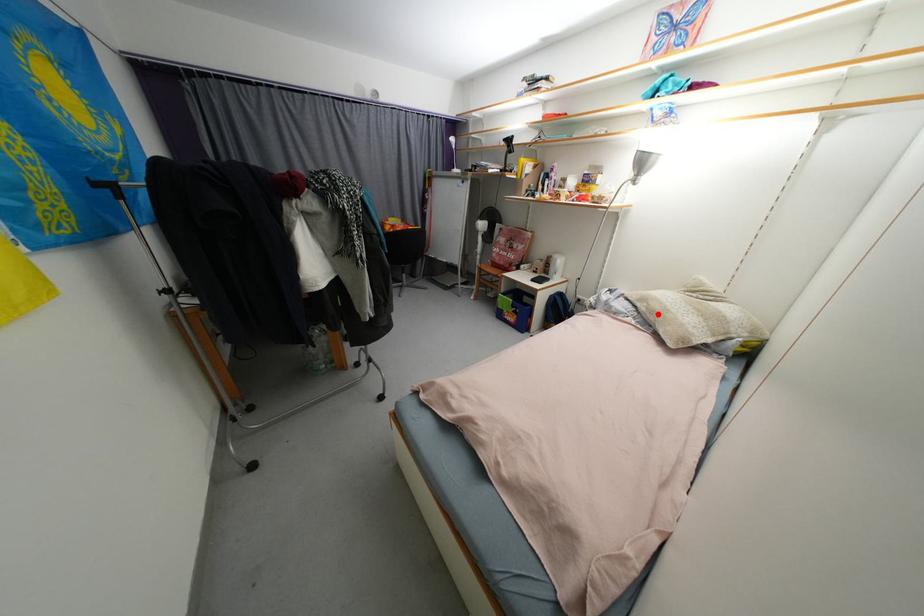
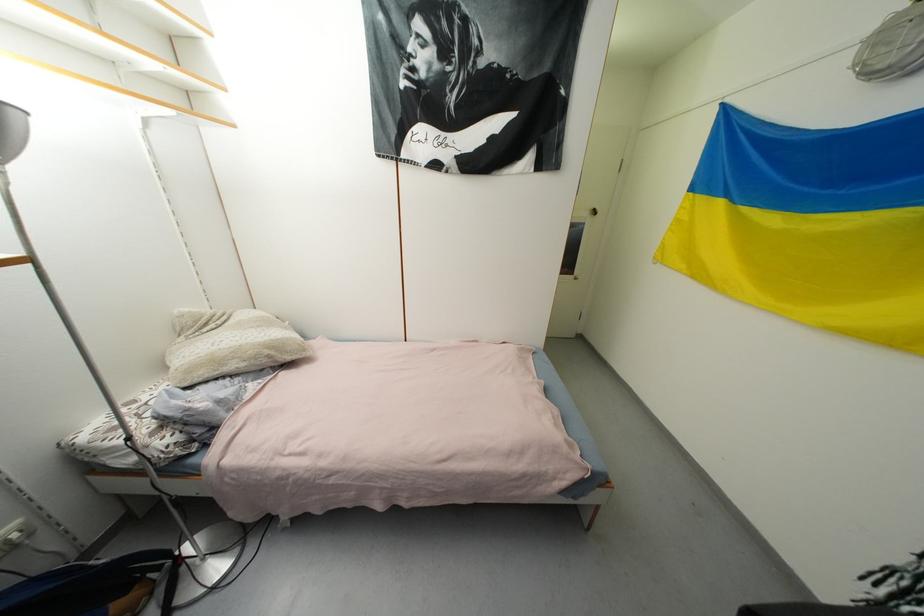
In the second image, find the point that corresponds to the highlighted location in the first image.

(261, 359)